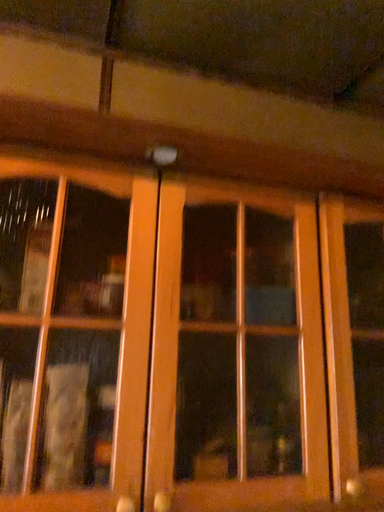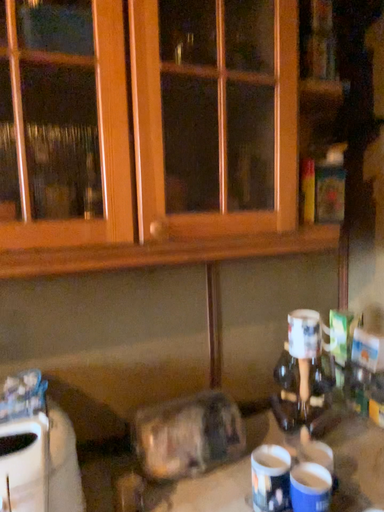
Question: Which way did the camera rotate in the video?

Choices:
 (A) rotated left
 (B) rotated right

Answer: (B)